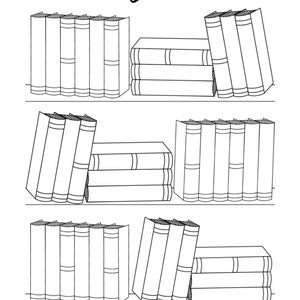
Find the location of `books laying flat`. books laying flat is located at coordinates (223, 295), (221, 281), (223, 267), (135, 193), (133, 180), (121, 161), (175, 87), (178, 72), (179, 59).